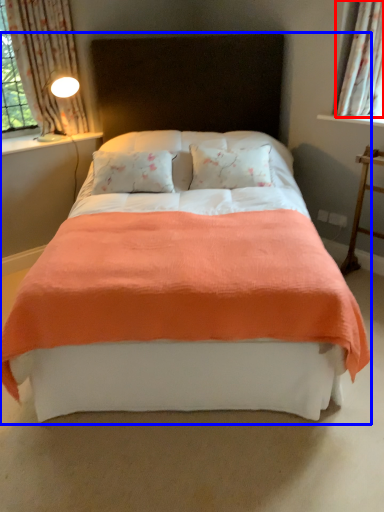
Question: Which object appears farthest to the camera in this image, curtain (highlighted by a red box) or bed (highlighted by a blue box)?

Choices:
 (A) curtain
 (B) bed

Answer: (A)